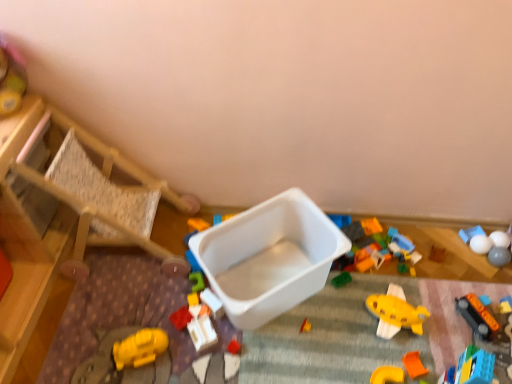
Identify the location of free point behind rubberized plastic toy at center, the thirteenth toy positioned from the right. (170, 289).